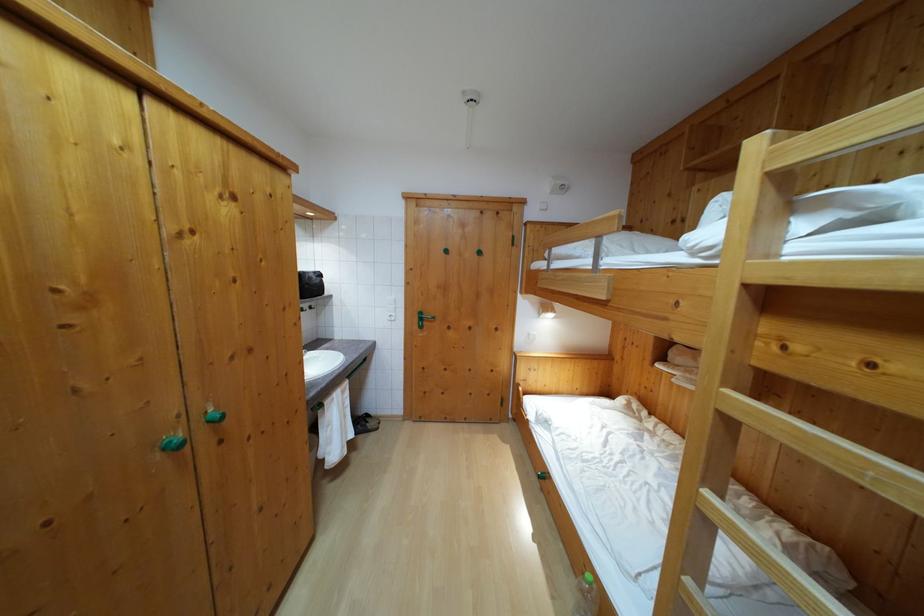
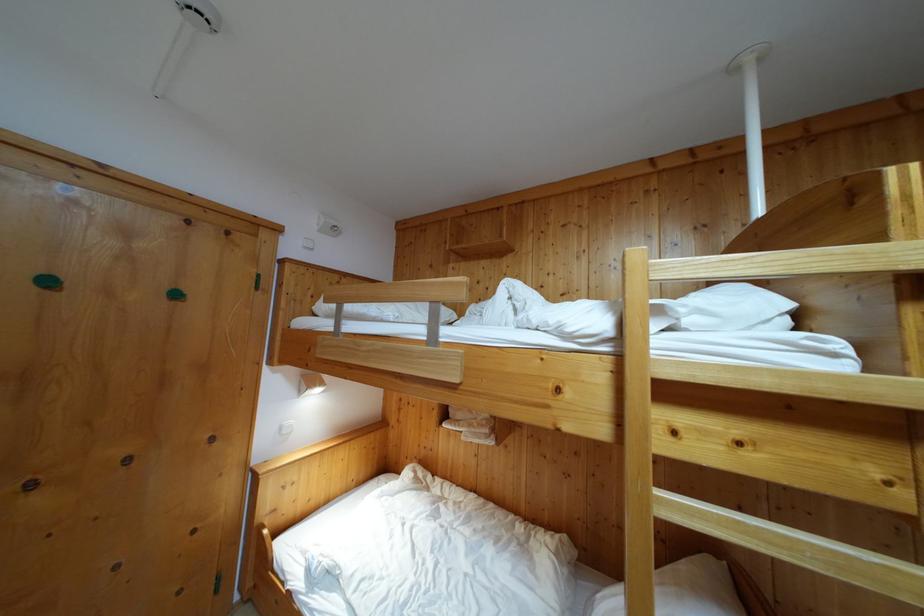
In the second image, find the point that corresponds to [727,397] in the first image.

(663, 500)